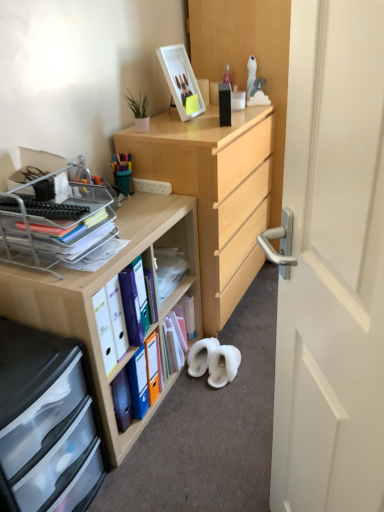
Question: Is white glossy picture frame at upper center inside the boundaries of transparent plastic drawers at lower left, or outside?

Choices:
 (A) inside
 (B) outside

Answer: (B)

Question: Looking at their shapes, would you say white glossy picture frame at upper center is wider or thinner than transparent plastic drawers at lower left?

Choices:
 (A) thin
 (B) wide

Answer: (A)

Question: Based on their relative distances, which object is farther from the white glossy picture frame at upper center?

Choices:
 (A) transparent plastic drawers at lower left
 (B) wooden desk at center
 (C) multicolored plastic pen holder at upper left

Answer: (A)

Question: Estimate the real-world distances between objects in this image. Which object is closer to the white glossy picture frame at upper center?

Choices:
 (A) multicolored plastic pen holder at upper left
 (B) transparent plastic drawers at lower left
 (C) wooden desk at center

Answer: (A)